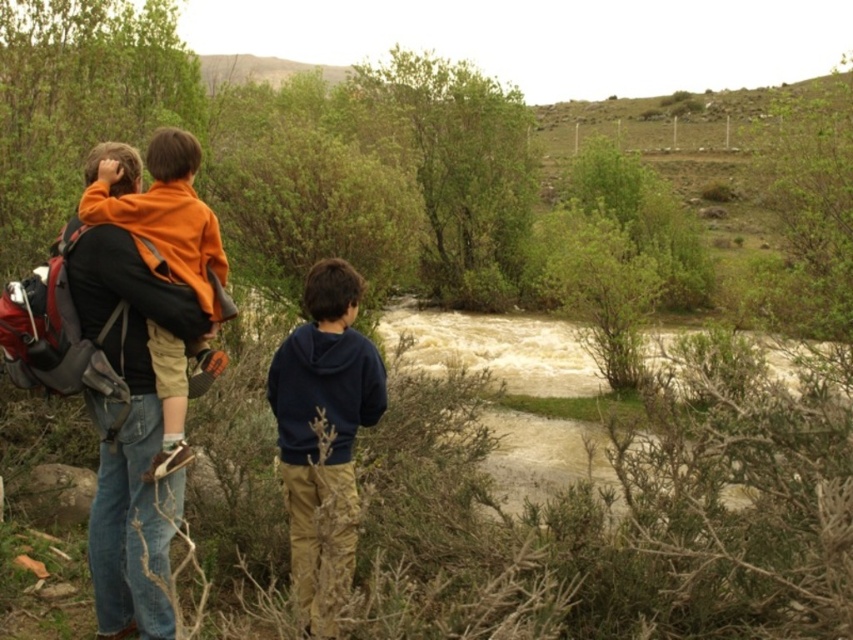
You are a photographer trying to capture a group photo of the two people in the scene. The navy blue hoodie at center and the orange fleece jacket at left are standing at different heights. Which person should you position closer to the camera to ensure both appear equally tall in the photo?

Since the navy blue hoodie at center is taller than the orange fleece jacket at left, you should position the orange fleece jacket at left closer to the camera to balance their apparent heights in the photo.

You are a photographer trying to capture a group photo of the two people in the scene. The camera you have can only focus on objects within a 30 inch range. Are both the navy blue hoodie at center and orange fleece jacket at left within the camera focus range?

The distance between the navy blue hoodie at center and orange fleece jacket at left is 34.74 inches, which exceeds the camera focus range of 30 inches. Therefore, both individuals cannot be in focus simultaneously.